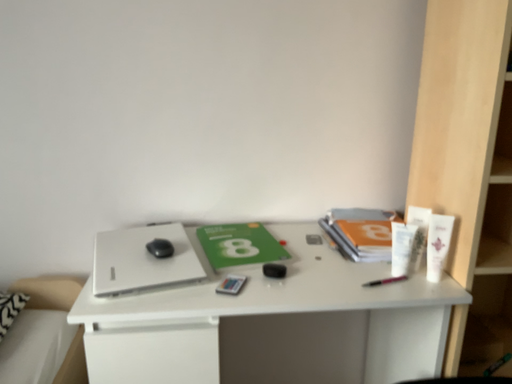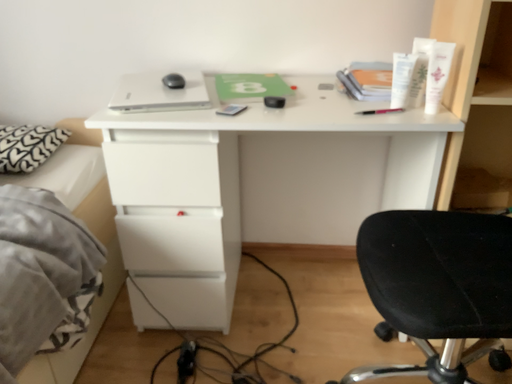
Question: How did the camera likely rotate when shooting the video?

Choices:
 (A) rotated upward
 (B) rotated downward

Answer: (B)